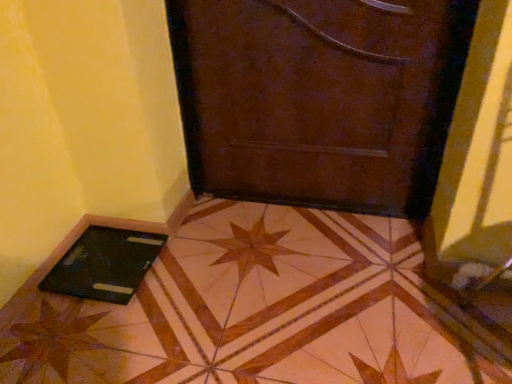
Question: Would you say brown leather door at center is a long distance from black glossy laptop at lower left?

Choices:
 (A) no
 (B) yes

Answer: (A)

Question: From the image's perspective, is brown leather door at center under black glossy laptop at lower left?

Choices:
 (A) no
 (B) yes

Answer: (A)

Question: From a real-world perspective, is brown leather door at center under black glossy laptop at lower left?

Choices:
 (A) yes
 (B) no

Answer: (B)

Question: Is brown leather door at center positioned in front of black glossy laptop at lower left?

Choices:
 (A) yes
 (B) no

Answer: (B)

Question: Is brown leather door at center located outside black glossy laptop at lower left?

Choices:
 (A) yes
 (B) no

Answer: (A)

Question: Does brown leather door at center have a greater height compared to black glossy laptop at lower left?

Choices:
 (A) no
 (B) yes

Answer: (B)

Question: Is the position of black matte tablet at lower left more distant than that of brown leather door at center?

Choices:
 (A) yes
 (B) no

Answer: (A)

Question: From the image's perspective, is black matte tablet at lower left located beneath brown leather door at center?

Choices:
 (A) yes
 (B) no

Answer: (A)

Question: Is black matte tablet at lower left at the left side of brown leather door at center?

Choices:
 (A) no
 (B) yes

Answer: (B)

Question: Could you tell me if black matte tablet at lower left is facing brown leather door at center?

Choices:
 (A) yes
 (B) no

Answer: (B)

Question: Would you say black matte tablet at lower left is a long distance from brown leather door at center?

Choices:
 (A) no
 (B) yes

Answer: (A)

Question: From a real-world perspective, is black matte tablet at lower left located beneath brown leather door at center?

Choices:
 (A) no
 (B) yes

Answer: (B)

Question: Considering the relative positions of black glossy laptop at lower left and black matte tablet at lower left in the image provided, is black glossy laptop at lower left to the left of black matte tablet at lower left from the viewer's perspective?

Choices:
 (A) yes
 (B) no

Answer: (B)